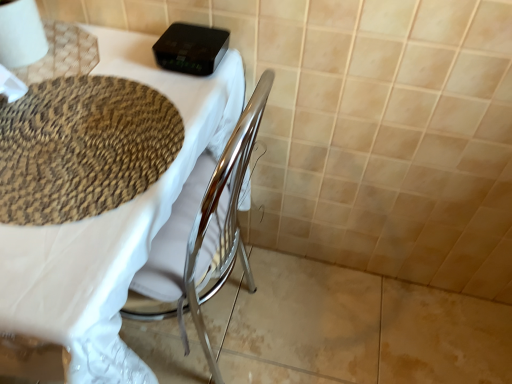
You are a GUI agent. You are given a task and a screenshot of the screen. Output one action in this format:
    pyautogui.click(x=<x>, y=<y>)
    Task: Click on the blank space above woven beige mat at upper left (from a real-world perspective)
    
    Given the screenshot: What is the action you would take?
    (84, 140)